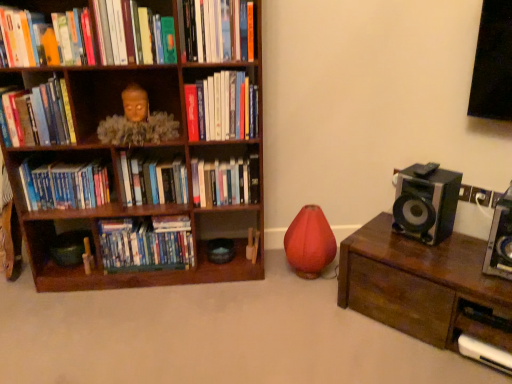
Question: From the image's perspective, is matte orange book at upper left, acting as the 3th book starting from the top, located beneath matte plastic dvds at lower left, which is counted as the first book, starting from the bottom?

Choices:
 (A) yes
 (B) no

Answer: (B)

Question: Does matte orange book at upper left, acting as the 3th book starting from the top, have a smaller size compared to matte plastic dvds at lower left, which is counted as the first book, starting from the bottom?

Choices:
 (A) yes
 (B) no

Answer: (A)

Question: Considering the relative positions of matte orange book at upper left, which is the seventh book from bottom to top, and matte plastic dvds at lower left, which is the 9th book in top-to-bottom order, in the image provided, is matte orange book at upper left, which is the seventh book from bottom to top, to the left of matte plastic dvds at lower left, which is the 9th book in top-to-bottom order, from the viewer's perspective?

Choices:
 (A) no
 (B) yes

Answer: (B)

Question: Is matte orange book at upper left, acting as the 3th book starting from the top, turned away from matte plastic dvds at lower left, which is the 9th book in top-to-bottom order?

Choices:
 (A) yes
 (B) no

Answer: (B)

Question: Is matte orange book at upper left, which is the seventh book from bottom to top, bigger than matte plastic dvds at lower left, which is counted as the first book, starting from the bottom?

Choices:
 (A) yes
 (B) no

Answer: (B)

Question: From the image's perspective, would you say matte orange book at upper left, acting as the 3th book starting from the top, is positioned over matte plastic dvds at lower left, which is counted as the first book, starting from the bottom?

Choices:
 (A) yes
 (B) no

Answer: (A)

Question: Are matte green book at upper center, which is counted as the second book, starting from the top, and matte orange book at upper left, which is the seventh book from bottom to top, far apart?

Choices:
 (A) yes
 (B) no

Answer: (B)

Question: Is matte green book at upper center, which is counted as the second book, starting from the top, positioned beyond the bounds of matte orange book at upper left, acting as the 3th book starting from the top?

Choices:
 (A) no
 (B) yes

Answer: (B)

Question: Is matte orange book at upper left, which is the seventh book from bottom to top, at the back of matte green book at upper center, which is counted as the second book, starting from the top?

Choices:
 (A) yes
 (B) no

Answer: (B)

Question: Does matte green book at upper center, which is counted as the second book, starting from the top, appear on the left side of matte orange book at upper left, which is the seventh book from bottom to top?

Choices:
 (A) yes
 (B) no

Answer: (B)

Question: Is the position of matte green book at upper center, the eighth book from the bottom, more distant than that of matte orange book at upper left, acting as the 3th book starting from the top?

Choices:
 (A) yes
 (B) no

Answer: (A)

Question: From the image's perspective, does matte green book at upper center, which is counted as the second book, starting from the top, appear lower than matte orange book at upper left, acting as the 3th book starting from the top?

Choices:
 (A) yes
 (B) no

Answer: (B)

Question: Considering the relative positions of brown wooden bookcase at left and hardcover book at upper center, the first book positioned from the top, in the image provided, is brown wooden bookcase at left to the left of hardcover book at upper center, the first book positioned from the top, from the viewer's perspective?

Choices:
 (A) no
 (B) yes

Answer: (B)